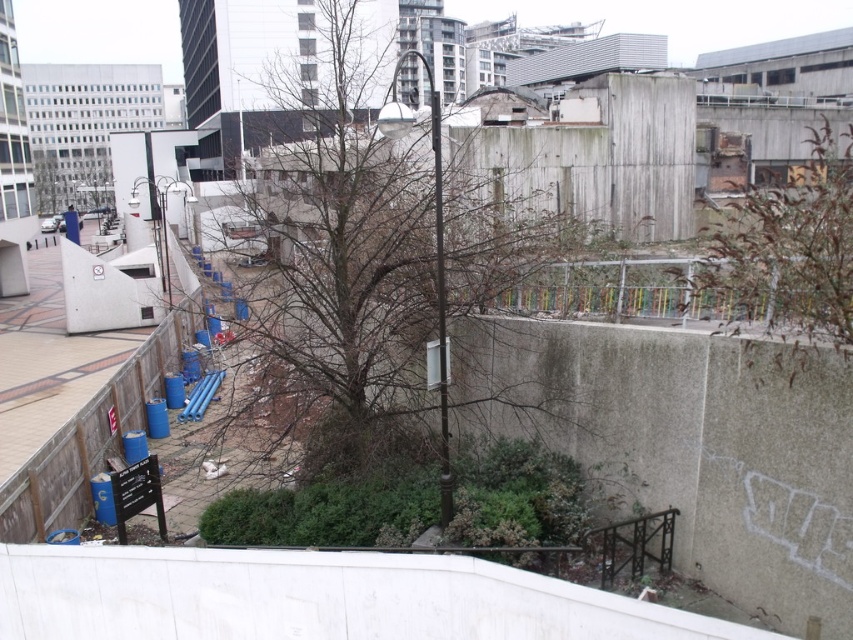
You are a photographer trying to capture both the brown textured tree at upper right and the green leafy tree at upper left in a single shot. Based on their positions, which tree would appear closer to the camera in the photo?

The brown textured tree at upper right appears closer to the camera because it is positioned in front of the green leafy tree at upper left.

You are standing at the point marked by the coordinates point (370, 250) in the urban scene. What object is exactly at this location?

The bare branches at center is located at point (370, 250).